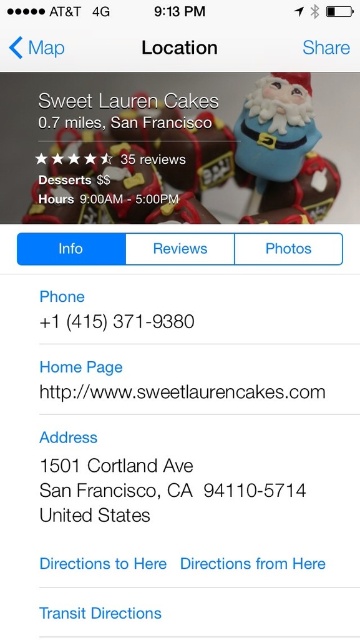
You are using a mobile app to view information about Sweet Lauren Cakes. You see a banner image with a matte blue figurine at upper right and a white paper address at center. Which object appears taller in the banner image?

The matte blue figurine at upper right is much taller than the white paper address at center.